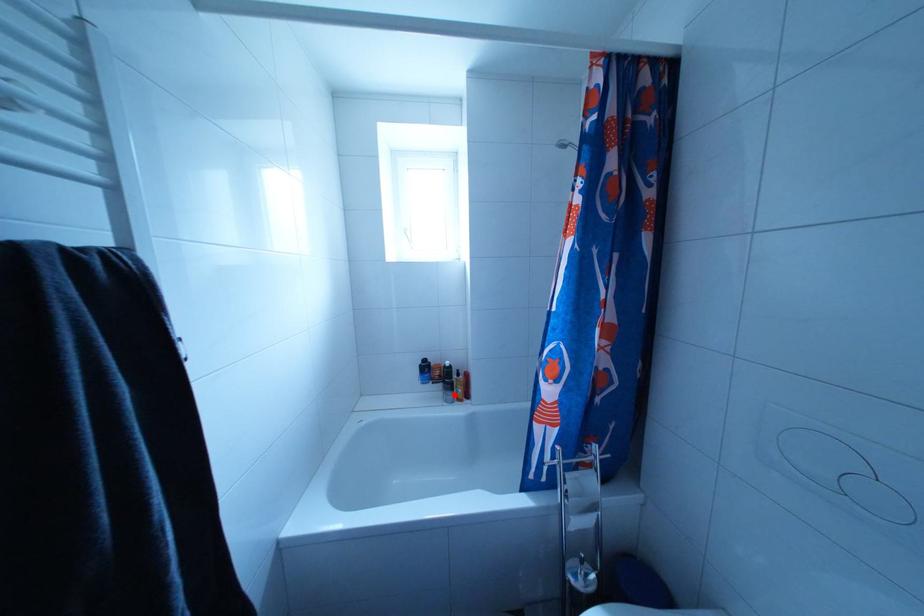
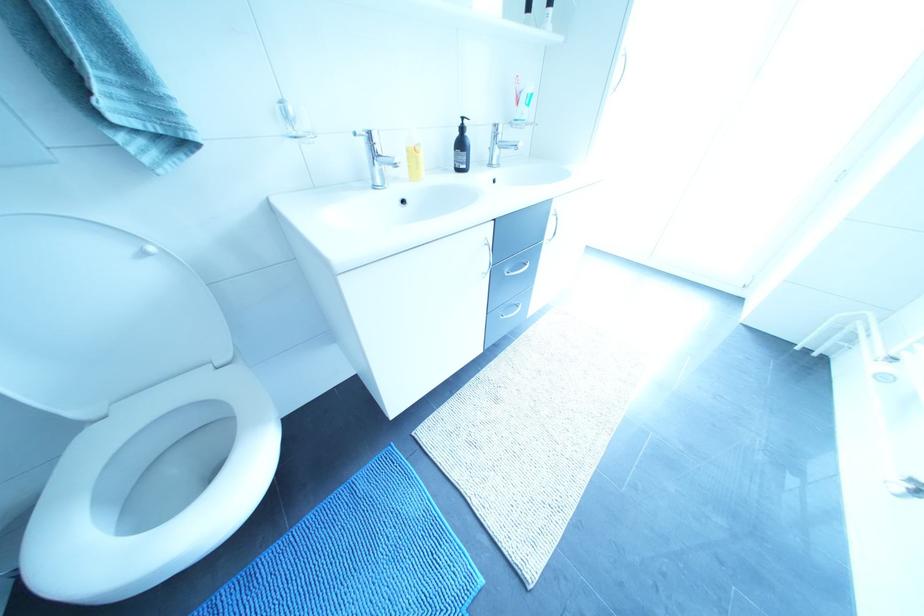
Question: I am providing you with two images of the same scene from different viewpoints. A red point is marked on the first image. Can you still see the location of the red point in image 2?

Choices:
 (A) Yes
 (B) No

Answer: (B)